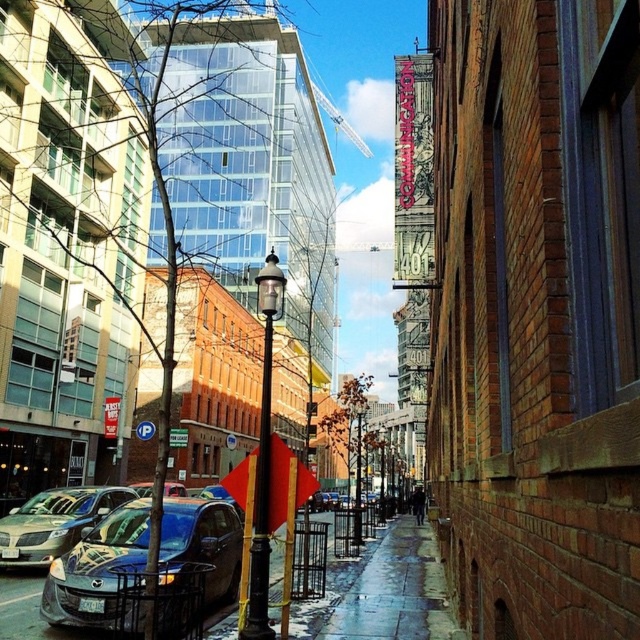
Can you confirm if shiny blue sedan at lower left is positioned below shiny silver sedan at left?

Actually, shiny blue sedan at lower left is above shiny silver sedan at left.

Between point (216, 593) and point (40, 545), which one is positioned behind?

Positioned behind is point (40, 545).

The width and height of the screenshot is (640, 640). What are the coordinates of `shiny blue sedan at lower left` in the screenshot? It's located at (102, 573).

Where is `shiny silver sedan at left`? The height and width of the screenshot is (640, 640). shiny silver sedan at left is located at coordinates coord(54,522).

Who is higher up, shiny silver sedan at left or black metal/texture lamp post at center?

Positioned higher is black metal/texture lamp post at center.

Find the location of a particular element. The width and height of the screenshot is (640, 640). shiny silver sedan at left is located at coordinates (54, 522).

Locate an element on the screen. The height and width of the screenshot is (640, 640). shiny silver sedan at left is located at coordinates (54, 522).

Who is more forward, (380,604) or (252,588)?

Point (252,588)

Is wet concrete sidewalk at center to the right of black metal/texture lamp post at center from the viewer's perspective?

Yes, wet concrete sidewalk at center is to the right of black metal/texture lamp post at center.

Is point (372, 618) closer to viewer compared to point (264, 349)?

No.

Locate an element on the screen. Image resolution: width=640 pixels, height=640 pixels. wet concrete sidewalk at center is located at coordinates (396, 592).